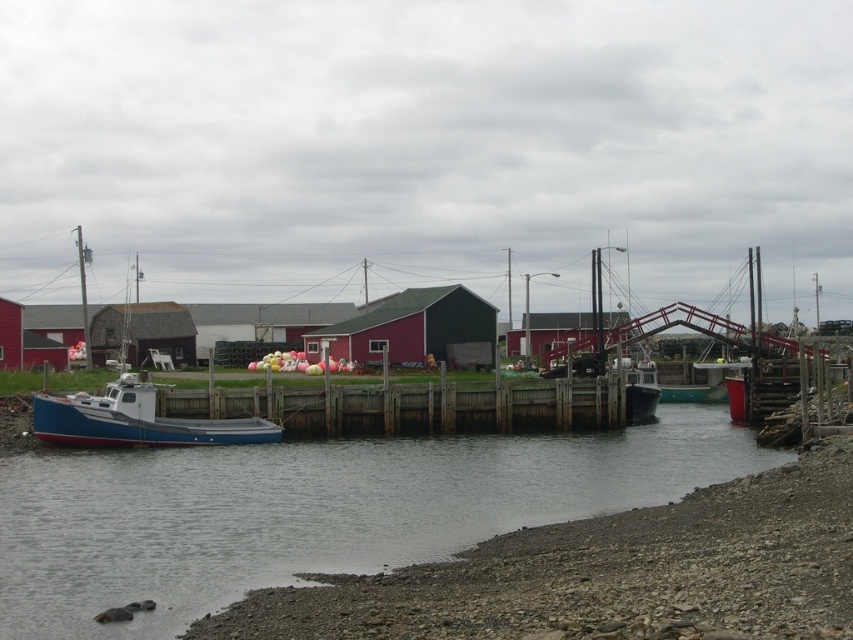
From the picture: You are standing at the center of the wooden pier and want to find the blue matte water at lower left. According to the coordinates provided, in which direction should you look to see it?

The blue matte water at lower left is located at point 0.800 on the x axis and 0.367 on the y axis. Since you are at the center of the wooden pier, looking towards the lower left direction would align with the coordinates given, so you should look to your lower left.

Looking at this image, you are standing at the edge of the wooden pier in the waterfront scene. You notice two points marked on the image. The first point is at coordinates point (590, 332) and the second is at point (4, 328). Which point is closer to your current position?

Point (590, 332) is closer to the camera than point (4, 328), so the first point is closer to your current position on the pier.